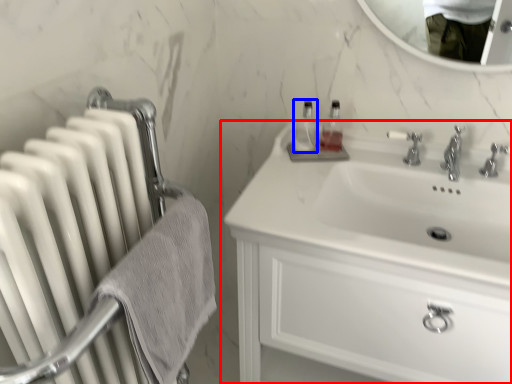
Question: Which of the following is the farthest to the observer, bathroom cabinet (highlighted by a red box) or bottle (highlighted by a blue box)?

Choices:
 (A) bathroom cabinet
 (B) bottle

Answer: (B)